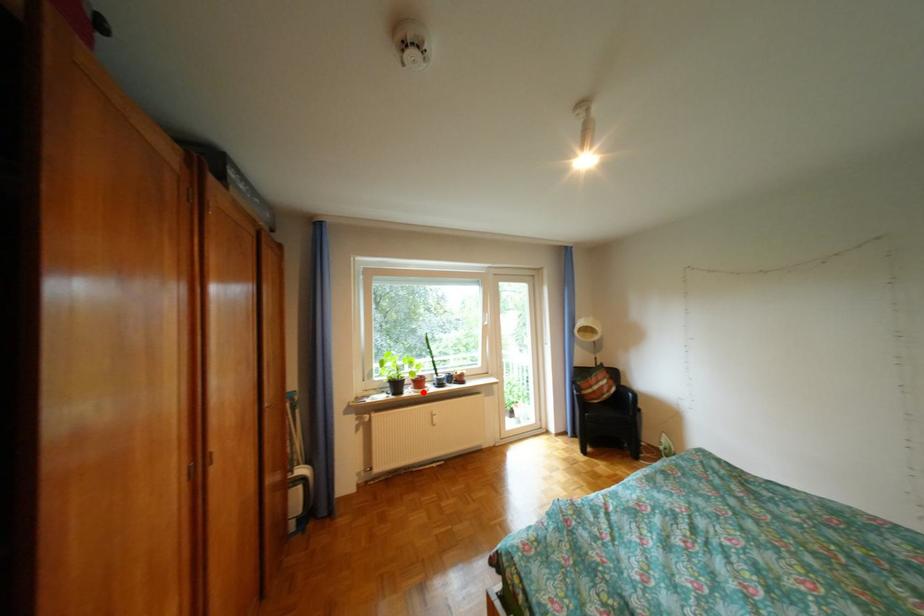
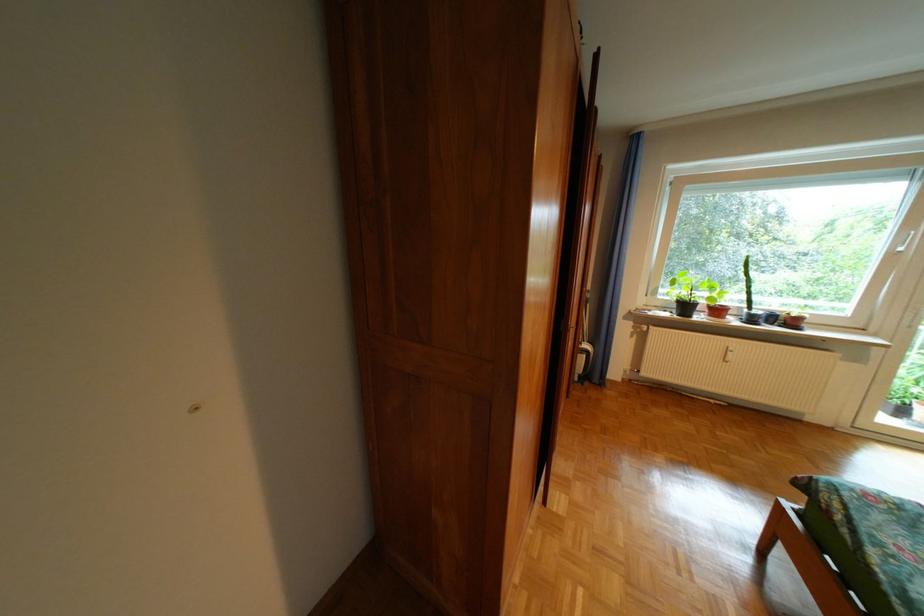
Where in the second image is the point corresponding to the highlighted location from the first image?

(714, 318)